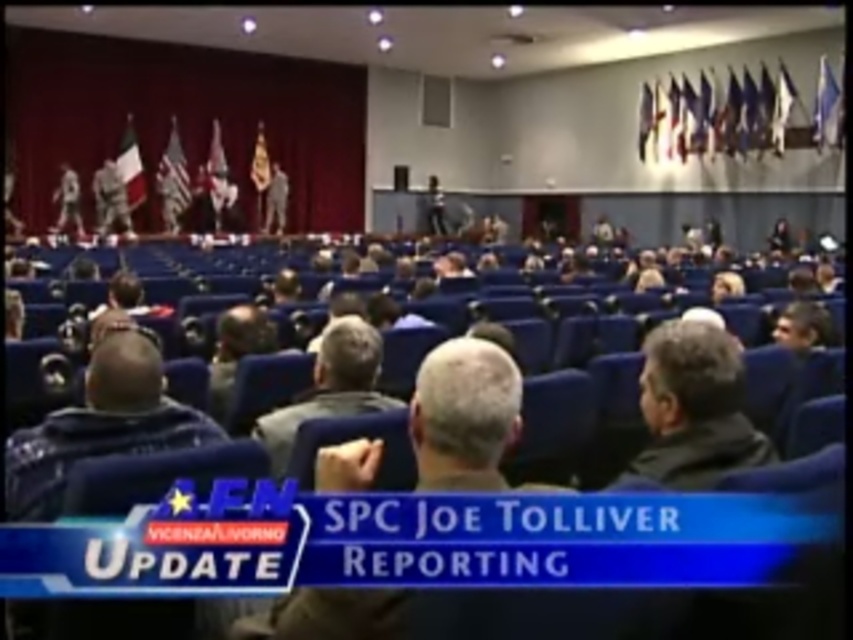
Question: Which of the following is the closest to the observer?

Choices:
 (A) (143, 356)
 (B) (670, 435)

Answer: (B)

Question: Which object appears farthest from the camera in this image?

Choices:
 (A) dark blue jacket at lower left
 (B) gray fabric jacket at center

Answer: (B)

Question: Which is farther from the dark blue jacket at lower left?

Choices:
 (A) gray fabric jacket at center
 (B) gray matte jacket at center

Answer: (B)

Question: Is dark blue jacket at lower left positioned before gray fabric jacket at center?

Choices:
 (A) no
 (B) yes

Answer: (B)

Question: Is the position of dark blue jacket at lower left less distant than that of gray fabric jacket at center?

Choices:
 (A) yes
 (B) no

Answer: (A)

Question: Can you confirm if dark blue jacket at lower left is positioned to the left of gray matte jacket at center?

Choices:
 (A) yes
 (B) no

Answer: (A)